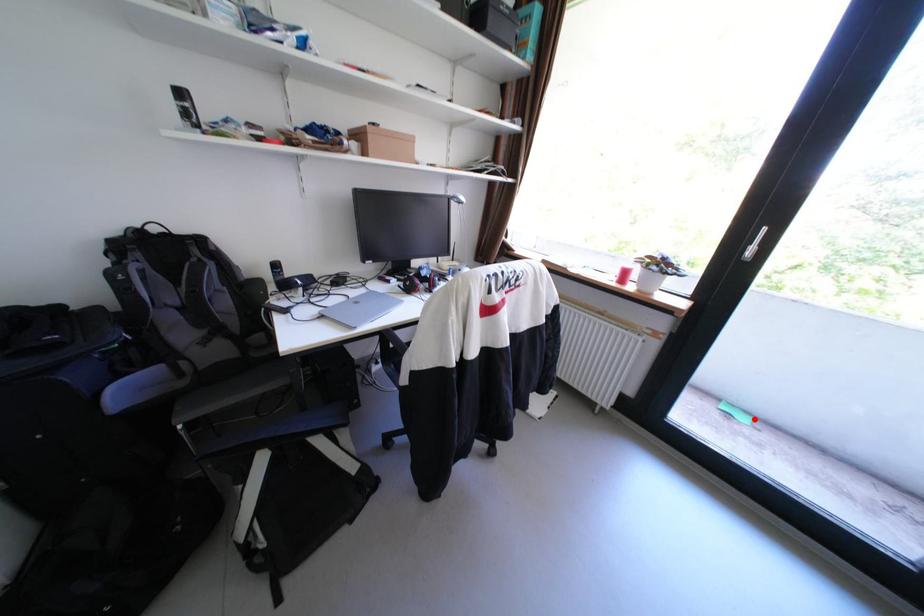
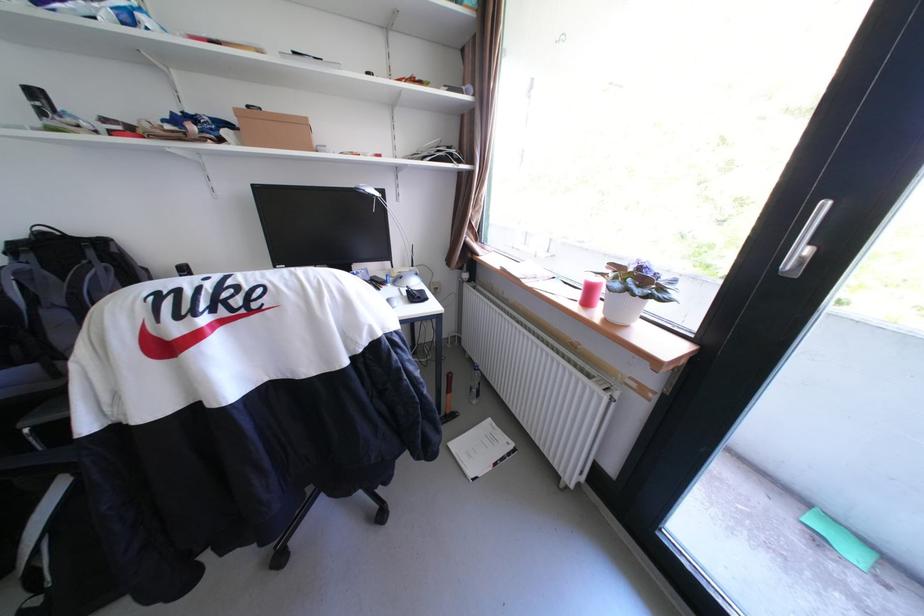
Where in the second image is the point corresponding to the highlighted location from the first image?

(867, 554)